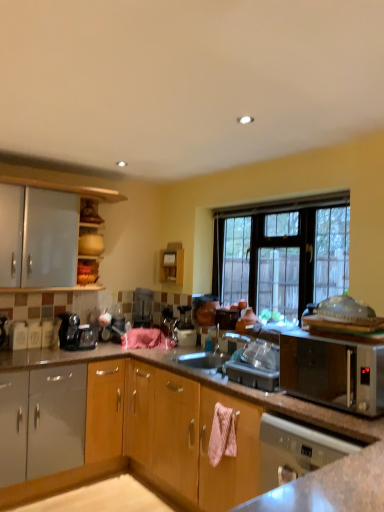
Question: Is satin silver dishwasher at lower right far away from black glass window at center?

Choices:
 (A) no
 (B) yes

Answer: (B)

Question: From the image's perspective, is satin silver dishwasher at lower right below black glass window at center?

Choices:
 (A) yes
 (B) no

Answer: (A)

Question: Does satin silver dishwasher at lower right appear on the right side of black glass window at center?

Choices:
 (A) yes
 (B) no

Answer: (A)

Question: Is satin silver dishwasher at lower right wider than black glass window at center?

Choices:
 (A) no
 (B) yes

Answer: (B)

Question: Is satin silver dishwasher at lower right facing away from black glass window at center?

Choices:
 (A) yes
 (B) no

Answer: (B)

Question: Does point (137, 291) appear closer or farther from the camera than point (286, 217)?

Choices:
 (A) farther
 (B) closer

Answer: (A)

Question: From the image's perspective, is metallic silver toaster at center located above or below black glass window at center?

Choices:
 (A) above
 (B) below

Answer: (B)

Question: From a real-world perspective, is metallic silver toaster at center positioned above or below black glass window at center?

Choices:
 (A) above
 (B) below

Answer: (B)

Question: Is metallic silver toaster at center to the left or to the right of black glass window at center in the image?

Choices:
 (A) right
 (B) left

Answer: (B)

Question: Looking at their shapes, would you say metallic silver toaster at center is wider or thinner than satin silver dishwasher at lower right?

Choices:
 (A) wide
 (B) thin

Answer: (B)

Question: Does point (140, 291) appear closer or farther from the camera than point (279, 425)?

Choices:
 (A) closer
 (B) farther

Answer: (B)

Question: Relative to satin silver dishwasher at lower right, is metallic silver toaster at center in front or behind?

Choices:
 (A) front
 (B) behind

Answer: (B)

Question: Is metallic silver toaster at center to the left or to the right of satin silver dishwasher at lower right in the image?

Choices:
 (A) right
 (B) left

Answer: (B)

Question: From the image's perspective, is black glass window at center above or below black plastic coffee machine at left?

Choices:
 (A) below
 (B) above

Answer: (B)

Question: Based on their sizes in the image, would you say black glass window at center is bigger or smaller than black plastic coffee machine at left?

Choices:
 (A) big
 (B) small

Answer: (A)